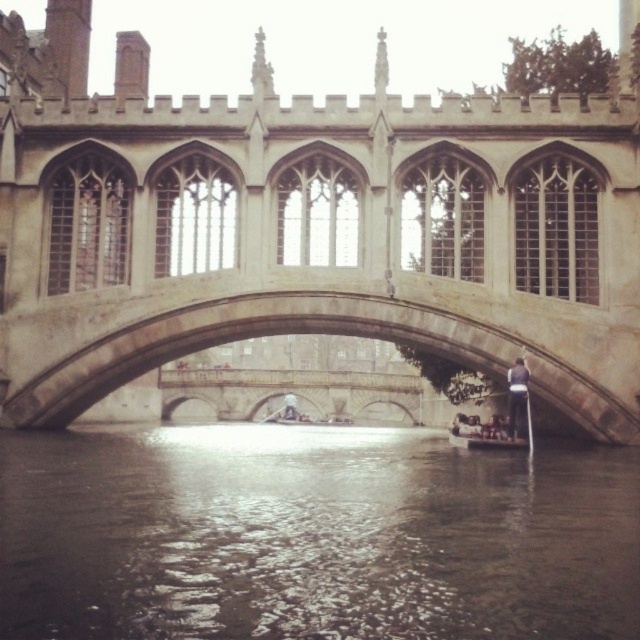
You are a tourist standing on the riverbank and want to take a photo of the stone bridge at center and the wooden boat at lower center. Which object should you focus on first if you want to capture both in a single shot without moving the camera?

The stone bridge at center is much taller than the wooden boat at lower center, so you should focus on the stone bridge at center first to ensure its full height is captured in the frame before adjusting for the wooden boat at lower center.

You are standing on the historic stone bridge and want to take a photo. There are two points of interest marked on the bridge surface at coordinates point (349,312) and point (81,353). Which point is closer to you so that you can capture it clearly in your photo?

Point (349,312) is closer to the camera than point (81,353), so you can capture it clearly in your photo.

You are standing on the historic stone bridge and looking down at the dark water at center and the wooden boat at lower center. Which object is closer to you from your perspective on the bridge?

The dark water at center is closer to you because it is in front of the wooden boat at lower center, meaning the boat is further away from your vantage point on the bridge.